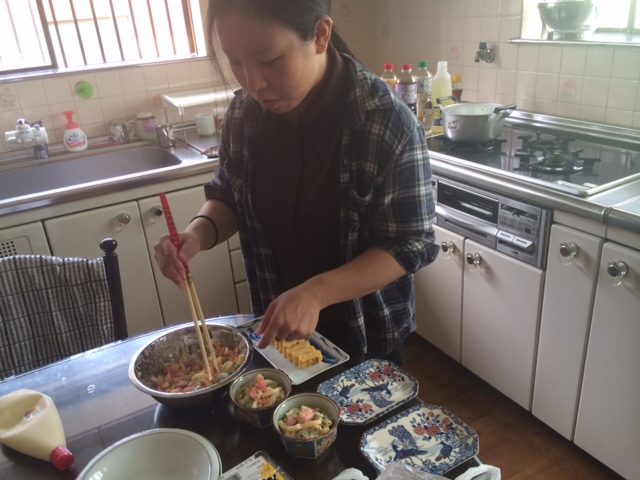
Find the location of a particular element. floor is located at coordinates (500, 427).